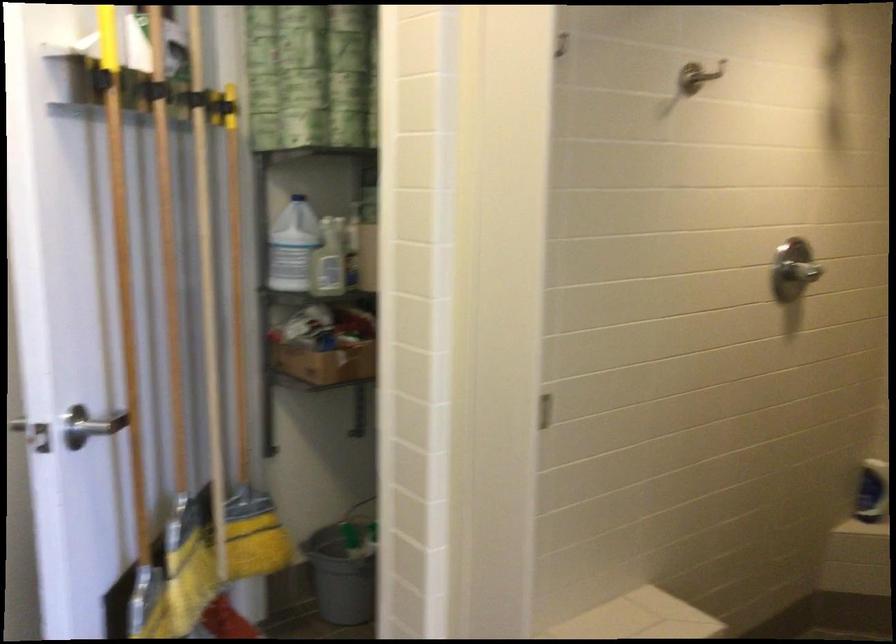
This screenshot has height=644, width=896. I want to click on silver wall hook, so click(x=698, y=77).